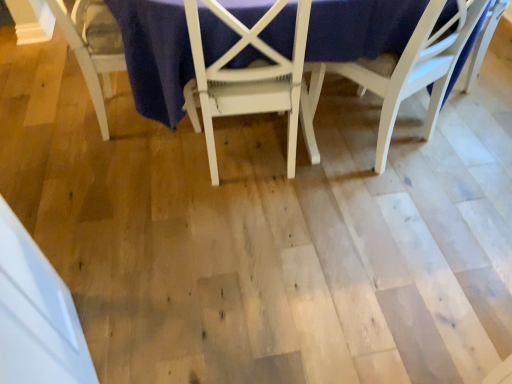
Question: Is white wood chair at upper right, which is the first chair in right-to-left order, smaller than white painted wood table at center?

Choices:
 (A) yes
 (B) no

Answer: (A)

Question: Does white wood chair at upper right, which is the first chair in right-to-left order, have a lesser height compared to white painted wood table at center?

Choices:
 (A) yes
 (B) no

Answer: (A)

Question: Is the depth of white wood chair at upper right, the 3th chair positioned from the left, less than that of white painted wood table at center?

Choices:
 (A) yes
 (B) no

Answer: (B)

Question: Would you say white painted wood table at center is part of white wood chair at upper right, the 3th chair positioned from the left,'s contents?

Choices:
 (A) no
 (B) yes

Answer: (A)

Question: From the image's perspective, is white wood chair at upper right, which is the first chair in right-to-left order, beneath white painted wood table at center?

Choices:
 (A) no
 (B) yes

Answer: (B)

Question: Is white painted wood table at center at the back of white wood chair at upper right, which is the first chair in right-to-left order?

Choices:
 (A) no
 (B) yes

Answer: (B)

Question: Can you confirm if white wood chair at lower left, which is counted as the first chair, starting from the left, is taller than white painted wood chair at center, which ranks as the second chair in right-to-left order?

Choices:
 (A) no
 (B) yes

Answer: (A)

Question: From the image's perspective, is white wood chair at lower left, which is counted as the first chair, starting from the left, under white painted wood chair at center, which ranks as the second chair in right-to-left order?

Choices:
 (A) yes
 (B) no

Answer: (B)

Question: Is white wood chair at lower left, which is the 3th chair in right-to-left order, far from white painted wood chair at center, which ranks as the second chair in right-to-left order?

Choices:
 (A) no
 (B) yes

Answer: (A)

Question: Does white wood chair at lower left, which is counted as the first chair, starting from the left, lie in front of white painted wood chair at center, which ranks as the second chair in right-to-left order?

Choices:
 (A) yes
 (B) no

Answer: (B)

Question: Considering the relative sizes of white wood chair at lower left, which is the 3th chair in right-to-left order, and white painted wood chair at center, the 2th chair when ordered from left to right, in the image provided, is white wood chair at lower left, which is the 3th chair in right-to-left order, bigger than white painted wood chair at center, the 2th chair when ordered from left to right,?

Choices:
 (A) no
 (B) yes

Answer: (A)

Question: Can you see white wood chair at lower left, which is counted as the first chair, starting from the left, touching white painted wood chair at center, the 2th chair when ordered from left to right?

Choices:
 (A) yes
 (B) no

Answer: (B)

Question: Is white wood chair at lower left, which is counted as the first chair, starting from the left, facing towards white wood chair at upper right, which is the first chair in right-to-left order?

Choices:
 (A) no
 (B) yes

Answer: (A)